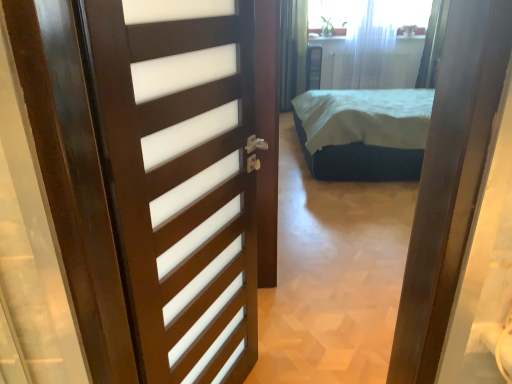
Question: Is white sheer curtain at upper center to the left or to the right of dark wood door at left in the image?

Choices:
 (A) right
 (B) left

Answer: (A)

Question: In the image, is white sheer curtain at upper center positioned in front of or behind dark wood door at left?

Choices:
 (A) front
 (B) behind

Answer: (B)

Question: Which object is positioned farthest from the dark green fabric bed at center?

Choices:
 (A) dark wood door at left
 (B) white sheer curtain at upper center

Answer: (A)

Question: Which is farther from the dark green fabric bed at center?

Choices:
 (A) white sheer curtain at upper center
 (B) dark wood door at left

Answer: (B)